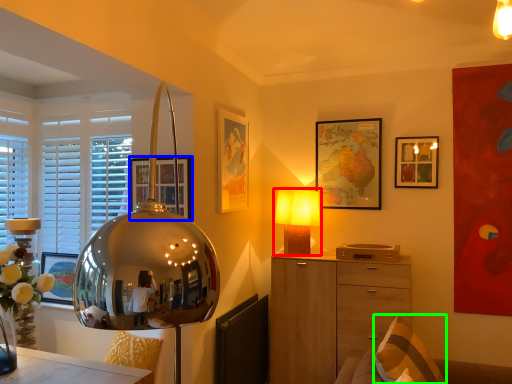
Question: Which object is positioned closest to lamp (highlighted by a red box)? Select from picture frame (highlighted by a blue box) and pillow (highlighted by a green box).

Choices:
 (A) picture frame
 (B) pillow

Answer: (A)